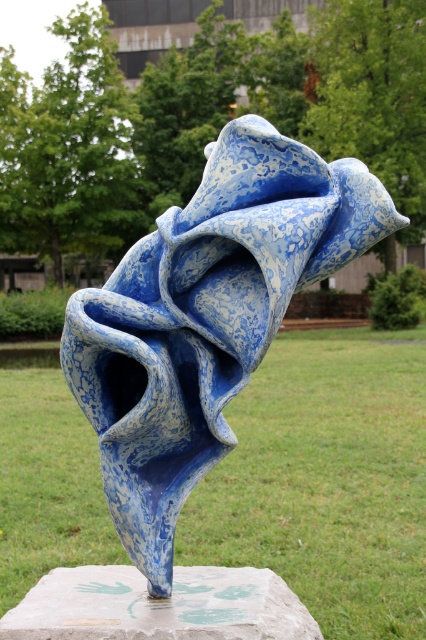
Is green grass at center taller than blue marbled stone sculpture at center?

No.

Who is positioned more to the right, green grass at center or blue marbled stone sculpture at center?

green grass at center is more to the right.

What do you see at coordinates (325, 481) in the screenshot?
I see `green grass at center` at bounding box center [325, 481].

Identify the location of green grass at center. This screenshot has width=426, height=640. (325, 481).

Does green grass at center have a lesser height compared to marble stone at center?

Indeed, green grass at center has a lesser height compared to marble stone at center.

Is green grass at center above marble stone at center?

No, green grass at center is not above marble stone at center.

Where is `green grass at center`? This screenshot has width=426, height=640. green grass at center is located at coordinates (325, 481).

Can you confirm if blue marbled stone sculpture at center is shorter than marble stone at center?

In fact, blue marbled stone sculpture at center may be taller than marble stone at center.

Is point (294, 148) positioned after point (11, 632)?

Yes, point (294, 148) is farther from viewer.

Does point (265, 308) come farther from viewer compared to point (72, 579)?

No, (265, 308) is in front of (72, 579).

Where is `blue marbled stone sculpture at center`? This screenshot has height=640, width=426. blue marbled stone sculpture at center is located at coordinates (206, 317).